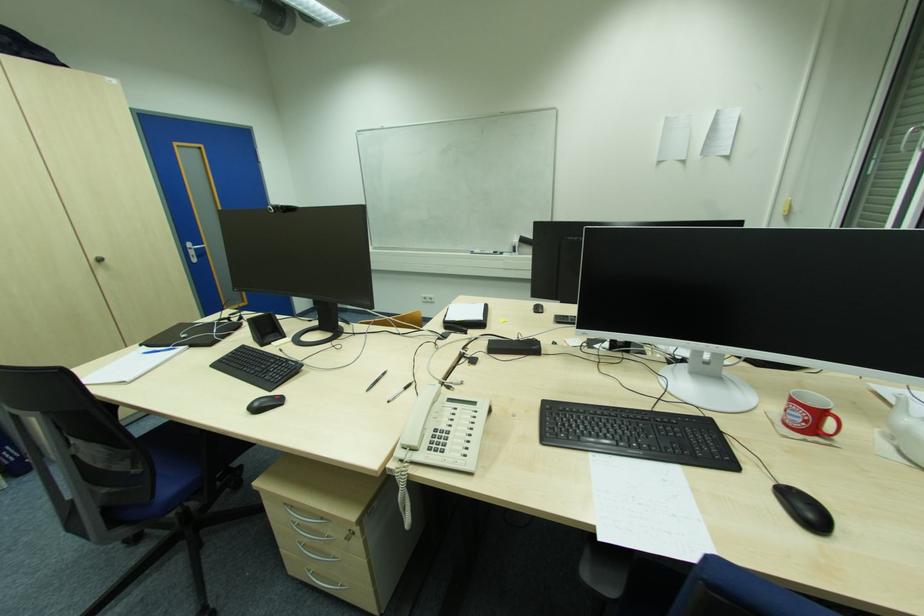
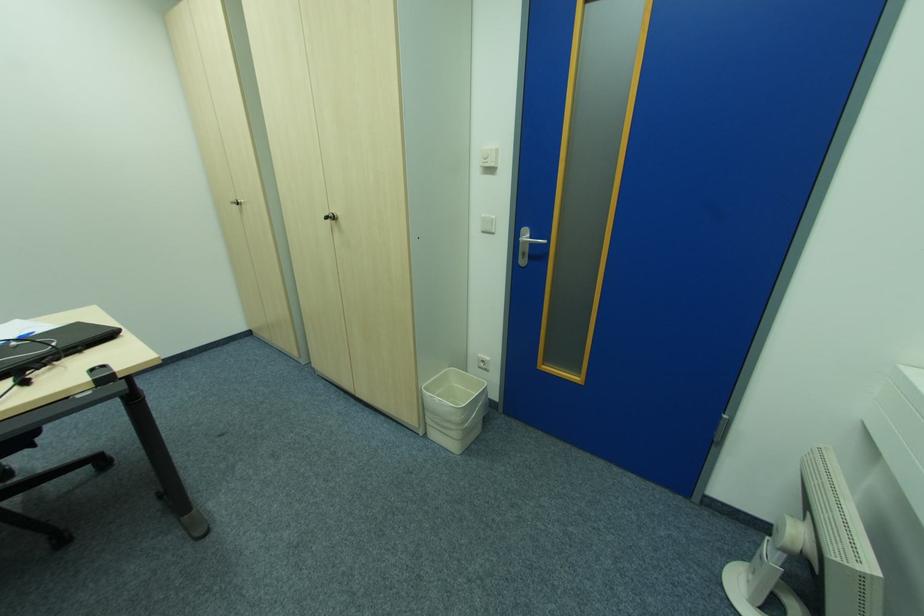
Where in the second image is the point corresponding to (196,257) from the first image?

(526, 256)